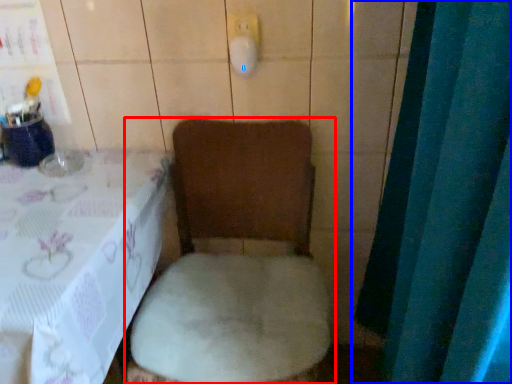
Question: Among these objects, which one is nearest to the camera, toilet (highlighted by a red box) or curtain (highlighted by a blue box)?

Choices:
 (A) toilet
 (B) curtain

Answer: (B)